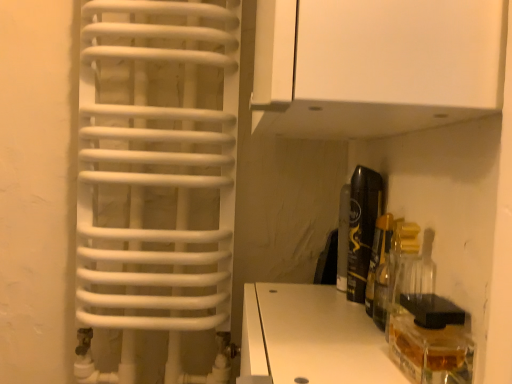
Question: Can you confirm if black glossy can at right, the 2th bottle positioned from the front, is bigger than clear glass bottle at center right, acting as the 2th bottle starting from the back?

Choices:
 (A) yes
 (B) no

Answer: (A)

Question: Does black glossy can at right, the 2th bottle positioned from the front, appear on the right side of clear glass bottle at center right, which is the first bottle in front-to-back order?

Choices:
 (A) yes
 (B) no

Answer: (B)

Question: Is black glossy can at right, which appears as the 1th bottle when viewed from the back, not near clear glass bottle at center right, which is the first bottle in front-to-back order?

Choices:
 (A) no
 (B) yes

Answer: (A)

Question: Can you confirm if black glossy can at right, the 2th bottle positioned from the front, is wider than clear glass bottle at center right, acting as the 2th bottle starting from the back?

Choices:
 (A) no
 (B) yes

Answer: (A)

Question: Does black glossy can at right, the 2th bottle positioned from the front, have a smaller size compared to clear glass bottle at center right, which is the first bottle in front-to-back order?

Choices:
 (A) no
 (B) yes

Answer: (A)

Question: Is black glossy can at right, which appears as the 1th bottle when viewed from the back, touching clear glass bottle at center right, which is the first bottle in front-to-back order?

Choices:
 (A) no
 (B) yes

Answer: (B)

Question: Can you confirm if white matte cabinet at upper center is wider than clear glass bottle at center right, acting as the 2th bottle starting from the back?

Choices:
 (A) no
 (B) yes

Answer: (B)

Question: From a real-world perspective, is white matte cabinet at upper center located higher than clear glass bottle at center right, acting as the 2th bottle starting from the back?

Choices:
 (A) yes
 (B) no

Answer: (A)

Question: Is white matte cabinet at upper center smaller than clear glass bottle at center right, acting as the 2th bottle starting from the back?

Choices:
 (A) yes
 (B) no

Answer: (B)

Question: Is white matte cabinet at upper center shorter than clear glass bottle at center right, acting as the 2th bottle starting from the back?

Choices:
 (A) no
 (B) yes

Answer: (A)

Question: Is white matte cabinet at upper center taller than clear glass bottle at center right, acting as the 2th bottle starting from the back?

Choices:
 (A) no
 (B) yes

Answer: (B)

Question: Is white matte cabinet at upper center positioned in front of clear glass bottle at center right, which is the first bottle in front-to-back order?

Choices:
 (A) yes
 (B) no

Answer: (A)

Question: From the image's perspective, would you say black glossy can at right, the 2th bottle positioned from the front, is shown under white matte cabinet at upper center?

Choices:
 (A) no
 (B) yes

Answer: (B)